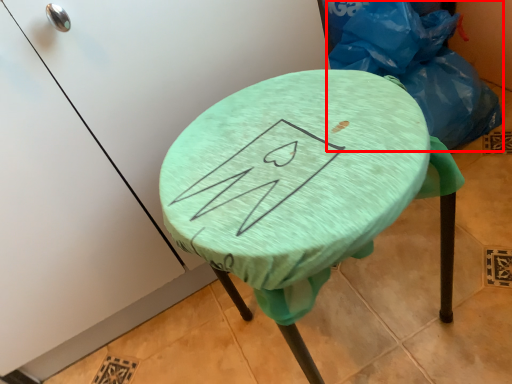
Question: From the image's perspective, considering the relative positions of garbage (annotated by the red box) and furniture in the image provided, where is garbage (annotated by the red box) located with respect to the staircase?

Choices:
 (A) below
 (B) above

Answer: (B)